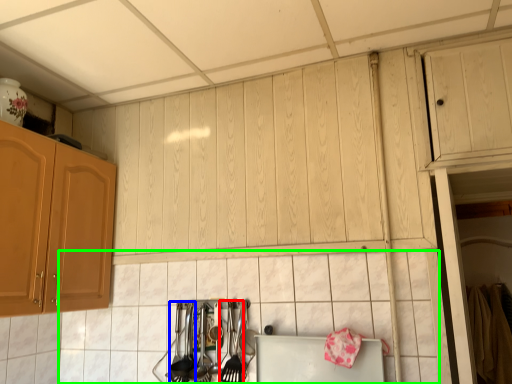
Question: Which is farther away from silverware (highlighted by a red box)? silverware (highlighted by a blue box) or tile (highlighted by a green box)?

Choices:
 (A) silverware
 (B) tile

Answer: (B)